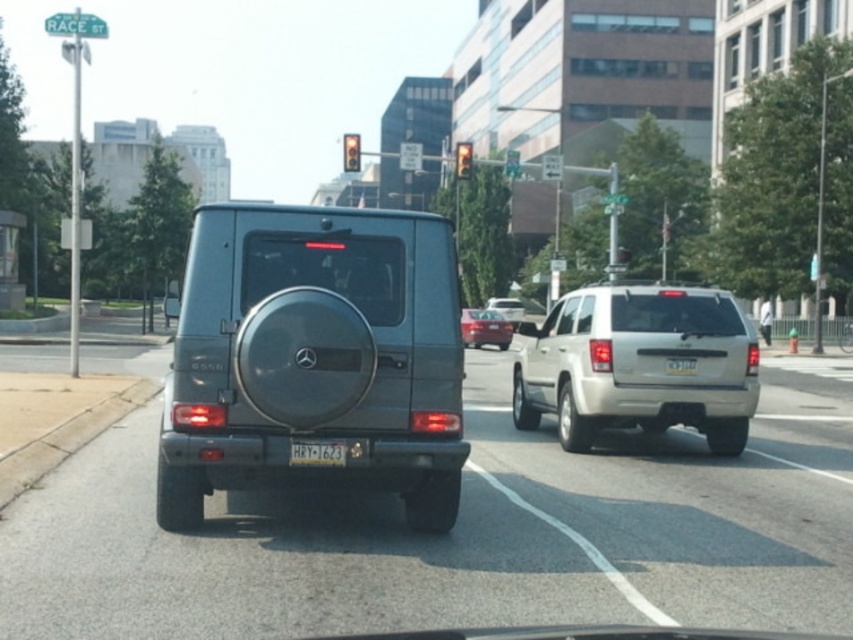
You are a driver looking ahead from the stopped vehicle. Where is the matte gray suv at center located in terms of coordinates?

The matte gray suv at center is located at coordinates point [315,358].

You are a passenger in the stopped vehicle and want to read the license plate of the vehicle directly in front of you. Which license plate should you look at, the one at point (317, 452) or another location?

The white plastic license plate at center is located at point (317, 452), so you should look at the license plate at that point.

You are sitting in the driver seat of a car stopped at a traffic light. You notice a point at coordinate (315, 358). What does this point represent?

The point at coordinate (315, 358) represents the matte gray suv at center.